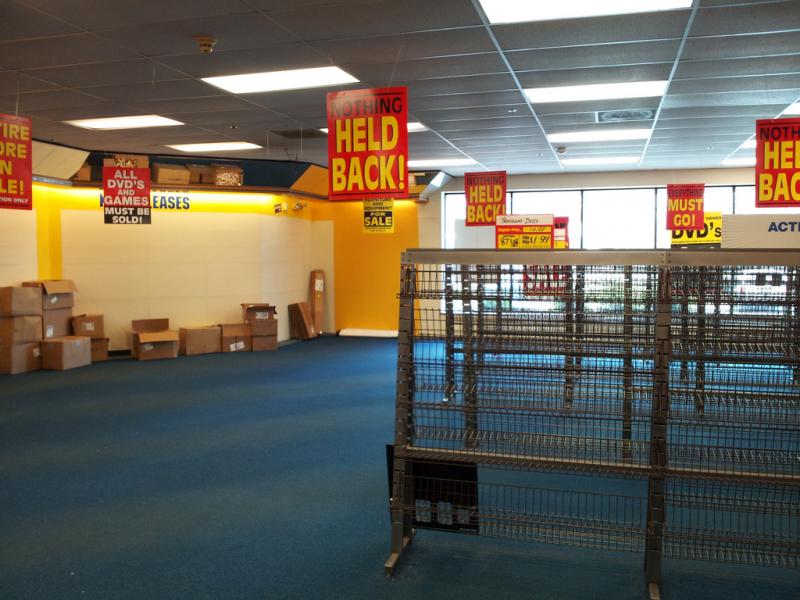
The width and height of the screenshot is (800, 600). I want to click on a/c vents, so click(630, 116).